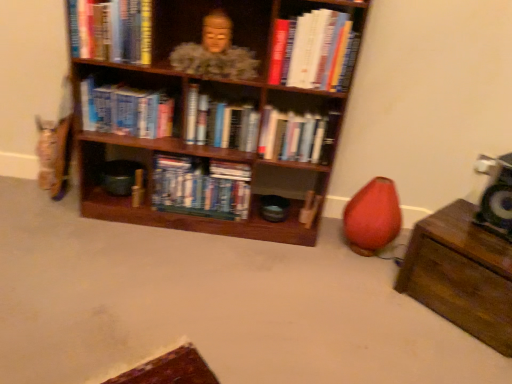
Locate an element on the screen. Image resolution: width=512 pixels, height=384 pixels. vacant region in front of wooden bookshelf at center is located at coordinates (184, 289).